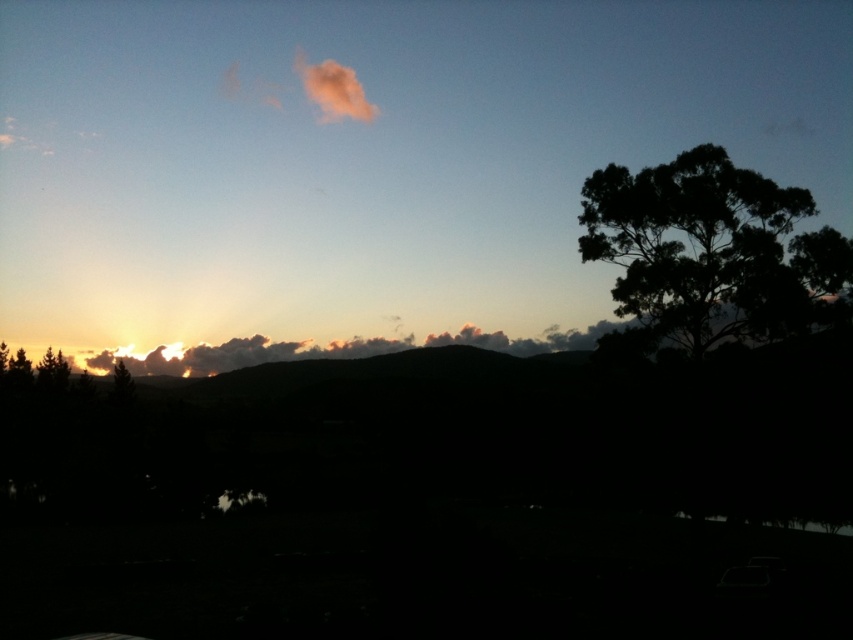
You are a photographer trying to capture the sunset. You have a camera with a 50mm lens that can focus on objects up to 100 feet away. You want to take a photo that includes both the dark green leafy tree at right and the fuzzy pink cloud at upper center. Is this possible?

The dark green leafy tree at right and the fuzzy pink cloud at upper center are 268.63 feet apart. Since the camera can only focus on objects up to 100 feet away, it cannot capture both objects in focus simultaneously because they are farther apart than the lens allows.

You are standing at the point with coordinates point (x=712, y=252) in the image. What object are you standing on?

You are standing on the dark green leafy tree at right.